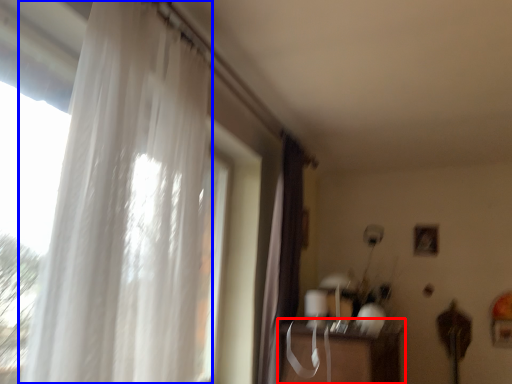
Question: Which object is closer to the camera taking this photo, table (highlighted by a red box) or curtain (highlighted by a blue box)?

Choices:
 (A) table
 (B) curtain

Answer: (B)